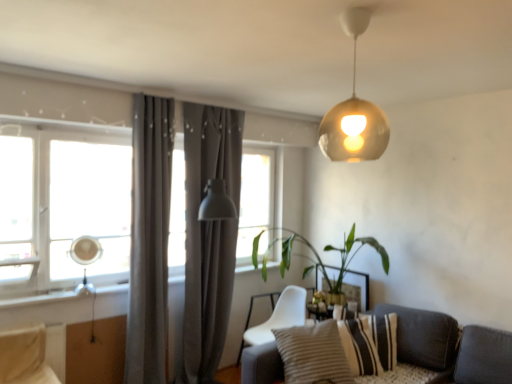
Question: From the image's perspective, is transparent glass window at left on green leafy plant at center?

Choices:
 (A) yes
 (B) no

Answer: (A)

Question: Is transparent glass window at left thinner than green leafy plant at center?

Choices:
 (A) no
 (B) yes

Answer: (B)

Question: From a real-world perspective, is transparent glass window at left located higher than green leafy plant at center?

Choices:
 (A) no
 (B) yes

Answer: (B)

Question: Can you confirm if transparent glass window at left is shorter than green leafy plant at center?

Choices:
 (A) no
 (B) yes

Answer: (A)

Question: Is transparent glass window at left oriented towards green leafy plant at center?

Choices:
 (A) no
 (B) yes

Answer: (B)

Question: Are transparent glass window at left and green leafy plant at center making contact?

Choices:
 (A) yes
 (B) no

Answer: (B)

Question: Can you confirm if striped fabric pillow at lower right, which is the first pillow in front-to-back order, is positioned to the right of gold metallic sphere at upper center?

Choices:
 (A) no
 (B) yes

Answer: (A)

Question: Is striped fabric pillow at lower right, which is the first pillow in front-to-back order, to the left of gold metallic sphere at upper center from the viewer's perspective?

Choices:
 (A) no
 (B) yes

Answer: (B)

Question: From a real-world perspective, is striped fabric pillow at lower right, the second pillow positioned from the back, physically below gold metallic sphere at upper center?

Choices:
 (A) yes
 (B) no

Answer: (A)

Question: Could you tell me if striped fabric pillow at lower right, the second pillow positioned from the back, is turned towards gold metallic sphere at upper center?

Choices:
 (A) yes
 (B) no

Answer: (B)

Question: Is the position of striped fabric pillow at lower right, the second pillow positioned from the back, more distant than that of gold metallic sphere at upper center?

Choices:
 (A) no
 (B) yes

Answer: (B)

Question: Is striped fabric pillow at lower right, the second pillow positioned from the back, surrounding gold metallic sphere at upper center?

Choices:
 (A) yes
 (B) no

Answer: (B)

Question: From the image's perspective, is matte gray curtain at center, which is counted as the 2th curtain, starting from the front, on top of gold metallic sphere at upper center?

Choices:
 (A) no
 (B) yes

Answer: (A)